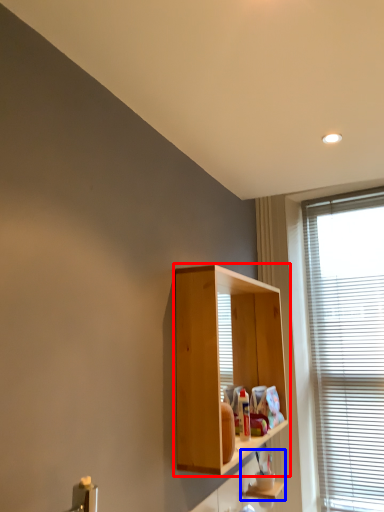
Question: Among these objects, which one is farthest to the camera, cabinetry (highlighted by a red box) or cabinet (highlighted by a blue box)?

Choices:
 (A) cabinetry
 (B) cabinet

Answer: (B)